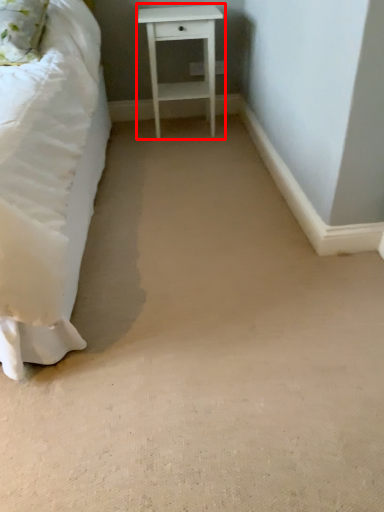
Question: From the image's perspective, where is nightstand (annotated by the red box) located in relation to pillow in the image?

Choices:
 (A) above
 (B) below

Answer: (A)